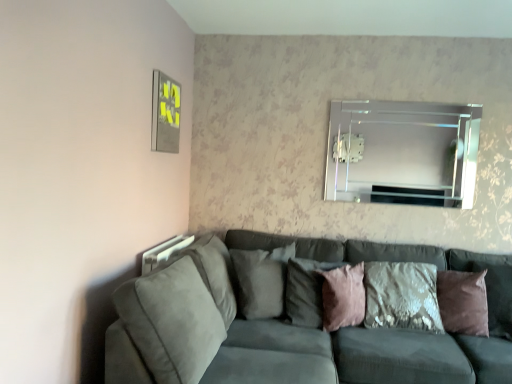
What do you see at coordinates (306, 291) in the screenshot? The height and width of the screenshot is (384, 512). I see `pink velvet pillow at center, the second pillow in the left-to-right sequence` at bounding box center [306, 291].

Describe the element at coordinates (343, 296) in the screenshot. I see `pink velvet pillow at center, which appears as the second pillow when viewed from the right` at that location.

Where is `brown velvet pillow at right, acting as the fourth pillow starting from the left`? brown velvet pillow at right, acting as the fourth pillow starting from the left is located at coordinates (490, 285).

Where is `suede gray couch at lower left`? suede gray couch at lower left is located at coordinates (308, 316).

At what (x,y) coordinates should I click in order to perform the action: click on pink velvet pillow at center, the 3th pillow viewed from the right. Please return your answer as a coordinate pair (x, y). The height and width of the screenshot is (384, 512). Looking at the image, I should click on (306, 291).

From the image's perspective, which is below, suede gray pillow at center, the fourth pillow positioned from the right, or clear glass mirror at upper center?

suede gray pillow at center, the fourth pillow positioned from the right, from the image's perspective.

Could you tell me if suede gray pillow at center, the first pillow viewed from the left, is turned towards clear glass mirror at upper center?

No, suede gray pillow at center, the first pillow viewed from the left, does not turn towards clear glass mirror at upper center.

Looking at this image, considering the positions of objects suede gray pillow at center, the first pillow viewed from the left, and clear glass mirror at upper center in the image provided, who is more to the right, suede gray pillow at center, the first pillow viewed from the left, or clear glass mirror at upper center?

From the viewer's perspective, clear glass mirror at upper center appears more on the right side.

Based on the photo, is suede gray pillow at center, the fourth pillow positioned from the right, spatially inside clear glass mirror at upper center, or outside of it?

suede gray pillow at center, the fourth pillow positioned from the right, is not inside clear glass mirror at upper center, it's outside.

In terms of width, does pink velvet pillow at center, the second pillow in the left-to-right sequence, look wider or thinner when compared to brown velvet pillow at right, acting as the fourth pillow starting from the left?

Considering their sizes, pink velvet pillow at center, the second pillow in the left-to-right sequence, looks slimmer than brown velvet pillow at right, acting as the fourth pillow starting from the left.

Considering the relative sizes of pink velvet pillow at center, the 3th pillow viewed from the right, and brown velvet pillow at right, which is the 1th pillow in right-to-left order, in the image provided, is pink velvet pillow at center, the 3th pillow viewed from the right, taller than brown velvet pillow at right, which is the 1th pillow in right-to-left order,?

In fact, pink velvet pillow at center, the 3th pillow viewed from the right, may be shorter than brown velvet pillow at right, which is the 1th pillow in right-to-left order.

From the image's perspective, is pink velvet pillow at center, the 3th pillow viewed from the right, positioned above or below brown velvet pillow at right, which is the 1th pillow in right-to-left order?

Clearly, from the image's perspective, pink velvet pillow at center, the 3th pillow viewed from the right, is above brown velvet pillow at right, which is the 1th pillow in right-to-left order.

Is the position of pink velvet pillow at center, the 3th pillow viewed from the right, more distant than that of brown velvet pillow at right, which is the 1th pillow in right-to-left order?

Yes, pink velvet pillow at center, the 3th pillow viewed from the right, is further from the camera.

Is suede gray pillow at center, the fourth pillow positioned from the right, looking in the opposite direction of brown velvet pillow at right, which is the 1th pillow in right-to-left order?

No, suede gray pillow at center, the fourth pillow positioned from the right,'s orientation is not away from brown velvet pillow at right, which is the 1th pillow in right-to-left order.

Considering the relative positions of suede gray pillow at center, the fourth pillow positioned from the right, and brown velvet pillow at right, which is the 1th pillow in right-to-left order, in the image provided, is suede gray pillow at center, the fourth pillow positioned from the right, to the left or to the right of brown velvet pillow at right, which is the 1th pillow in right-to-left order,?

In the image, suede gray pillow at center, the fourth pillow positioned from the right, appears on the left side of brown velvet pillow at right, which is the 1th pillow in right-to-left order.

Based on the photo, is suede gray pillow at center, the first pillow viewed from the left, far away from brown velvet pillow at right, which is the 1th pillow in right-to-left order?

Yes, suede gray pillow at center, the first pillow viewed from the left, and brown velvet pillow at right, which is the 1th pillow in right-to-left order, are located far from each other.

How far apart are suede gray pillow at center, the fourth pillow positioned from the right, and brown velvet pillow at right, which is the 1th pillow in right-to-left order?

suede gray pillow at center, the fourth pillow positioned from the right, and brown velvet pillow at right, which is the 1th pillow in right-to-left order, are 4.28 feet apart from each other.

Find the location of a particular element. Image resolution: width=512 pixels, height=384 pixels. pillow that is the 2nd object to the right of the suede gray couch at lower left, starting at the anchor is located at coordinates (490, 285).

Considering the sizes of objects brown velvet pillow at right, which is the 1th pillow in right-to-left order, and suede gray couch at lower left in the image provided, who is smaller, brown velvet pillow at right, which is the 1th pillow in right-to-left order, or suede gray couch at lower left?

With smaller size is brown velvet pillow at right, which is the 1th pillow in right-to-left order.

Is brown velvet pillow at right, which is the 1th pillow in right-to-left order, turned away from suede gray couch at lower left?

Absolutely, brown velvet pillow at right, which is the 1th pillow in right-to-left order, is directed away from suede gray couch at lower left.

Between brown velvet pillow at right, which is the 1th pillow in right-to-left order, and suede gray couch at lower left, which one has more height?

suede gray couch at lower left.

From the picture: Does suede gray couch at lower left have a lesser width compared to brown velvet pillow at right, which is the 1th pillow in right-to-left order?

Incorrect, the width of suede gray couch at lower left is not less than that of brown velvet pillow at right, which is the 1th pillow in right-to-left order.

In the image, is suede gray couch at lower left on the left side or the right side of brown velvet pillow at right, which is the 1th pillow in right-to-left order?

From the image, it's evident that suede gray couch at lower left is to the left of brown velvet pillow at right, which is the 1th pillow in right-to-left order.

Do you think suede gray couch at lower left is within brown velvet pillow at right, acting as the fourth pillow starting from the left, or outside of it?

suede gray couch at lower left is not enclosed by brown velvet pillow at right, acting as the fourth pillow starting from the left.

Does point (403, 358) appear closer or farther from the camera than point (499, 266)?

Point (403, 358).

From the image's perspective, which is below, brown velvet pillow at right, which is the 1th pillow in right-to-left order, or suede gray pillow at center, the first pillow viewed from the left?

From the image's view, brown velvet pillow at right, which is the 1th pillow in right-to-left order, is below.

The height and width of the screenshot is (384, 512). I want to click on the 2nd pillow in front of the suede gray pillow at center, the fourth pillow positioned from the right, so [x=490, y=285].

Between brown velvet pillow at right, acting as the fourth pillow starting from the left, and suede gray pillow at center, the first pillow viewed from the left, which one has larger width?

suede gray pillow at center, the first pillow viewed from the left.

Is brown velvet pillow at right, acting as the fourth pillow starting from the left, far away from suede gray pillow at center, the first pillow viewed from the left?

Yes, brown velvet pillow at right, acting as the fourth pillow starting from the left, and suede gray pillow at center, the first pillow viewed from the left, are located far from each other.

Image resolution: width=512 pixels, height=384 pixels. In order to click on pillow that is the 3rd object located behind the suede gray couch at lower left in this screenshot , I will do `click(306, 291)`.

In the scene shown: Which object is closer to the camera, pink velvet pillow at center, the 3th pillow viewed from the right, or suede gray couch at lower left?

suede gray couch at lower left is more forward.

Does pink velvet pillow at center, the second pillow in the left-to-right sequence, have a larger size compared to suede gray couch at lower left?

No, pink velvet pillow at center, the second pillow in the left-to-right sequence, is not bigger than suede gray couch at lower left.

From a real-world perspective, is pink velvet pillow at center, the 3th pillow viewed from the right, physically below suede gray couch at lower left?

No, from a real-world perspective, pink velvet pillow at center, the 3th pillow viewed from the right, is not below suede gray couch at lower left.

Find the location of a particular element. Image resolution: width=512 pixels, height=384 pixels. mirror on the right of suede gray pillow at center, the fourth pillow positioned from the right is located at coordinates (402, 152).

The width and height of the screenshot is (512, 384). In order to click on the 1st pillow below the brown velvet pillow at right, which is the 1th pillow in right-to-left order (from a real-world perspective) in this screenshot , I will do `click(306, 291)`.

When comparing their distances from suede gray couch at lower left, does pink velvet pillow at center, which appears as the second pillow when viewed from the right, or brown velvet pillow at right, acting as the fourth pillow starting from the left, seem closer?

pink velvet pillow at center, which appears as the second pillow when viewed from the right.

Considering their positions, is suede gray couch at lower left positioned closer to pink velvet pillow at center, the second pillow in the left-to-right sequence, than pink velvet pillow at center, marked as the third pillow in a left-to-right arrangement?

pink velvet pillow at center, marked as the third pillow in a left-to-right arrangement, is closer to pink velvet pillow at center, the second pillow in the left-to-right sequence.

Looking at this image, considering their positions, is pink velvet pillow at center, the 3th pillow viewed from the right, positioned closer to suede gray couch at lower left than suede gray pillow at center, the fourth pillow positioned from the right?

Among the two, suede gray pillow at center, the fourth pillow positioned from the right, is located nearer to suede gray couch at lower left.

Based on their spatial positions, is brown velvet pillow at right, which is the 1th pillow in right-to-left order, or pink velvet pillow at center, the second pillow in the left-to-right sequence, further from suede gray couch at lower left?

brown velvet pillow at right, which is the 1th pillow in right-to-left order, is further to suede gray couch at lower left.

Which object lies nearer to the anchor point suede gray couch at lower left, suede gray pillow at center, the first pillow viewed from the left, or pink velvet pillow at center, the second pillow in the left-to-right sequence?

suede gray pillow at center, the first pillow viewed from the left, is positioned closer to the anchor suede gray couch at lower left.

Estimate the real-world distances between objects in this image. Which object is closer to brown velvet pillow at right, which is the 1th pillow in right-to-left order, pink velvet pillow at center, marked as the third pillow in a left-to-right arrangement, or clear glass mirror at upper center?

pink velvet pillow at center, marked as the third pillow in a left-to-right arrangement.

Estimate the real-world distances between objects in this image. Which object is closer to suede gray pillow at center, the first pillow viewed from the left, brown velvet pillow at right, which is the 1th pillow in right-to-left order, or clear glass mirror at upper center?

clear glass mirror at upper center is positioned closer to the anchor suede gray pillow at center, the first pillow viewed from the left.

From the image, which object appears to be nearer to pink velvet pillow at center, the 3th pillow viewed from the right, suede gray pillow at center, the fourth pillow positioned from the right, or brown velvet pillow at right, which is the 1th pillow in right-to-left order?

suede gray pillow at center, the fourth pillow positioned from the right, is closer to pink velvet pillow at center, the 3th pillow viewed from the right.

Locate an element on the screen. The width and height of the screenshot is (512, 384). pillow between suede gray pillow at center, the first pillow viewed from the left, and pink velvet pillow at center, which appears as the second pillow when viewed from the right, in the horizontal direction is located at coordinates (306, 291).

Locate an element on the screen. The width and height of the screenshot is (512, 384). mirror between pink velvet pillow at center, the 3th pillow viewed from the right, and brown velvet pillow at right, which is the 1th pillow in right-to-left order is located at coordinates (402, 152).

Image resolution: width=512 pixels, height=384 pixels. I want to click on pillow situated between pink velvet pillow at center, the second pillow in the left-to-right sequence, and brown velvet pillow at right, acting as the fourth pillow starting from the left, from left to right, so click(x=343, y=296).

Identify the location of mirror located between suede gray pillow at center, the first pillow viewed from the left, and brown velvet pillow at right, which is the 1th pillow in right-to-left order, in the left-right direction. The width and height of the screenshot is (512, 384). (402, 152).